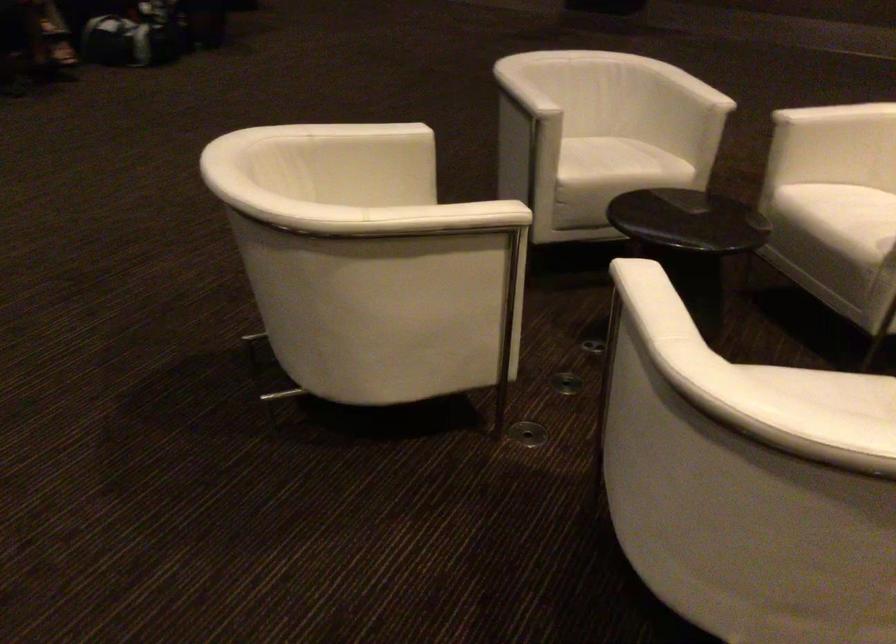
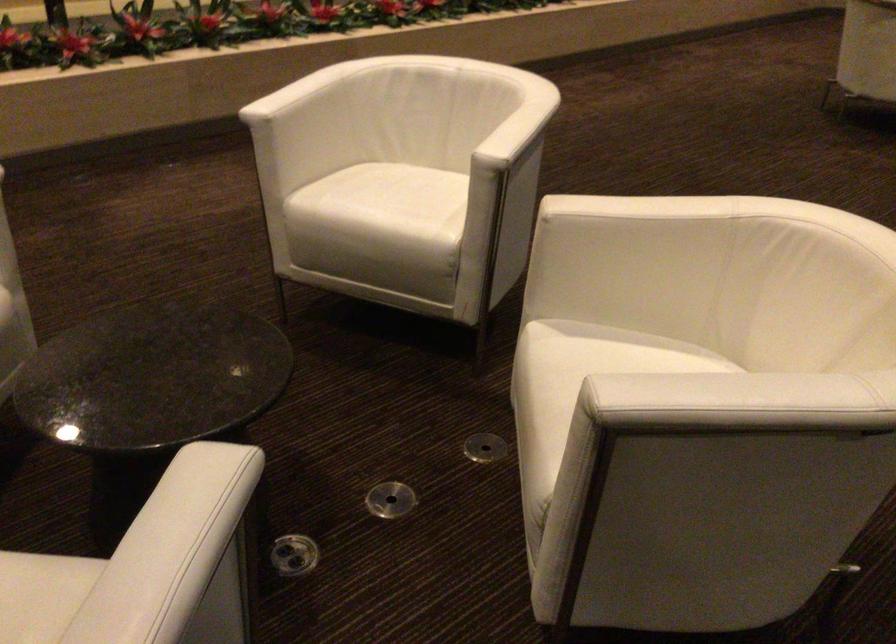
Find the pixel in the second image that matches point 513,82 in the first image.

(186, 527)